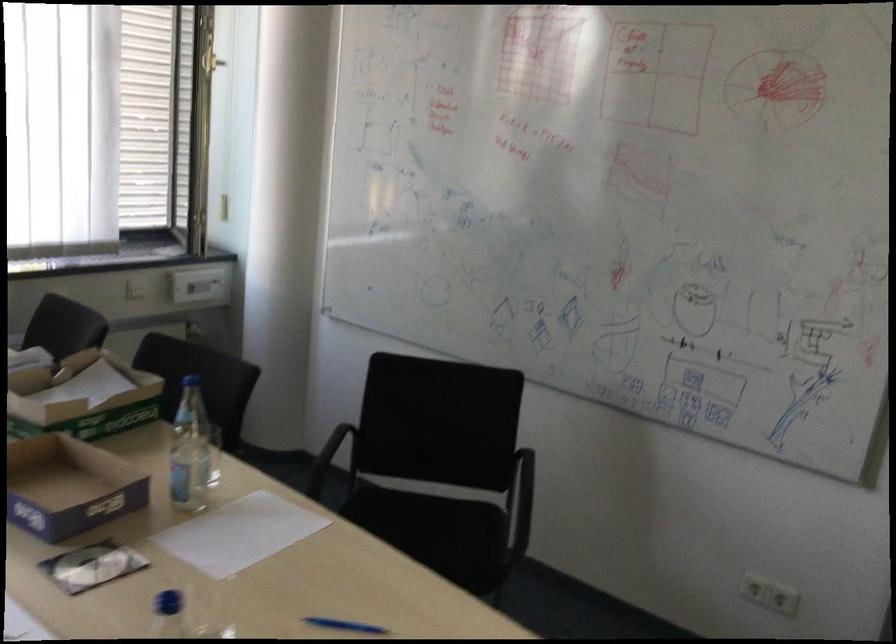
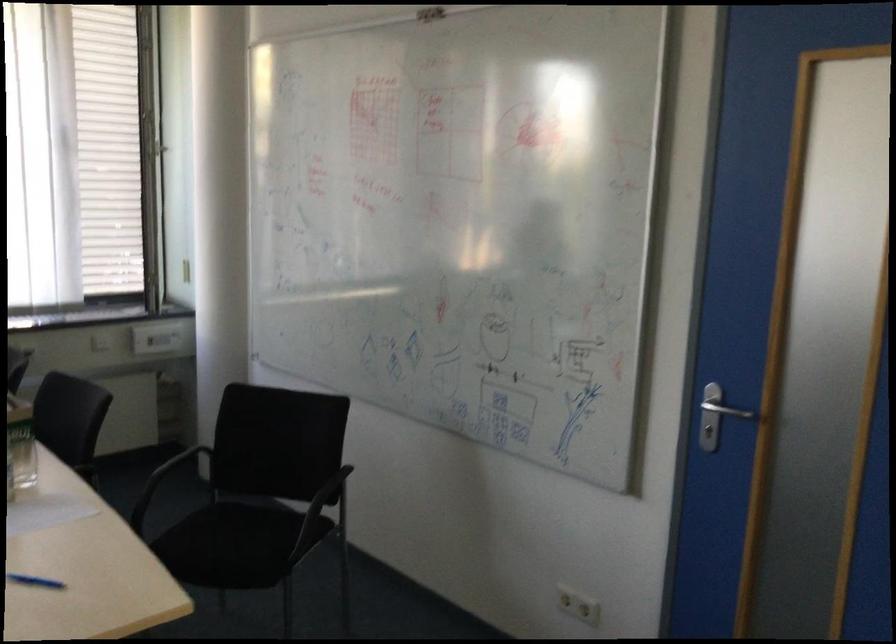
Find the pixel in the second image that matches (x=159, y=426) in the first image.

(21, 444)